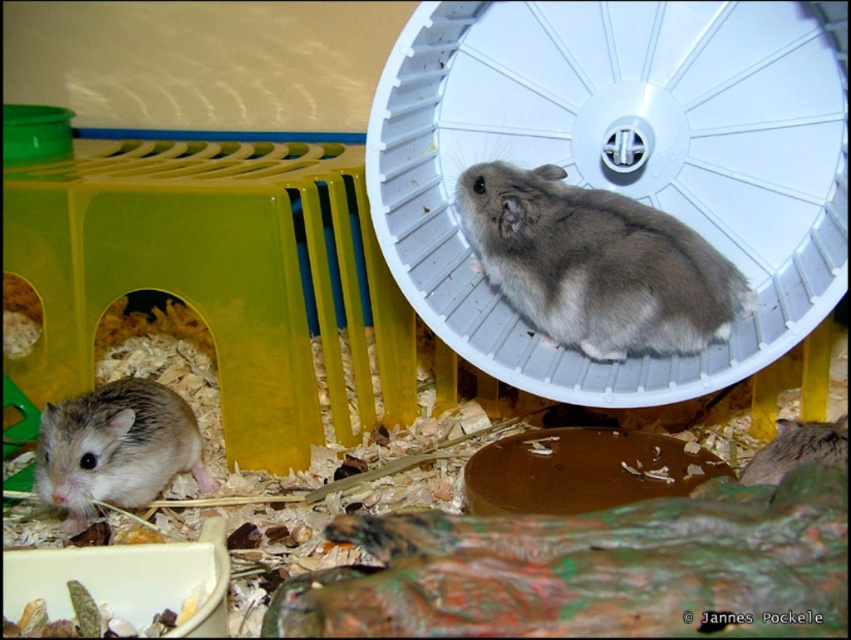
Is point (572, 252) positioned before point (72, 520)?

No, (572, 252) is further to viewer.

The image size is (851, 640). In order to click on fuzzy gray hamster at center in this screenshot , I will do `click(597, 264)`.